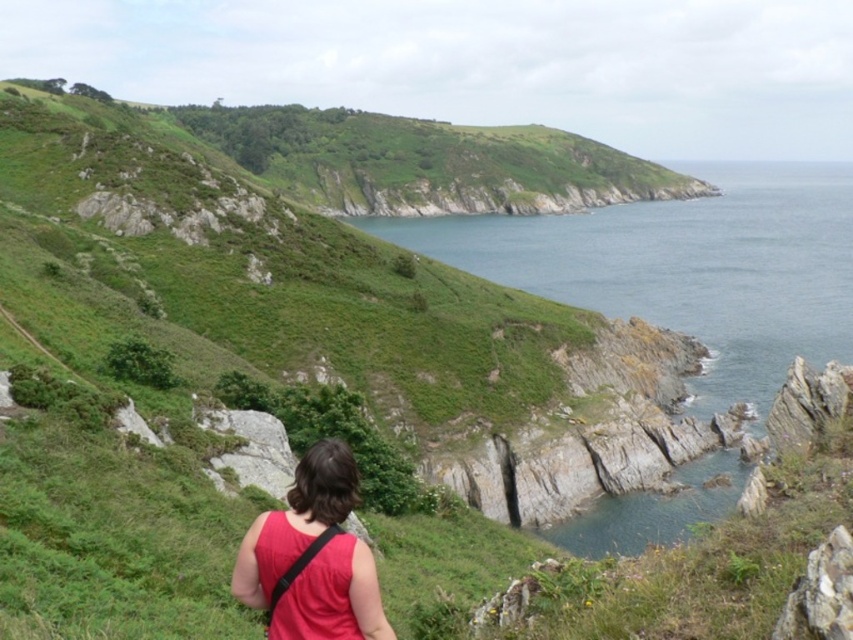
Is blue water at upper right above red matte tank top at lower center?

Yes.

Who is lower down, blue water at upper right or red matte tank top at lower center?

red matte tank top at lower center is below.

You are a GUI agent. You are given a task and a screenshot of the screen. Output one action in this format:
    pyautogui.click(x=<x>, y=<y>)
    Task: Click on the blue water at upper right
    The width and height of the screenshot is (853, 640).
    Given the screenshot: What is the action you would take?
    pyautogui.click(x=688, y=268)

Locate an element on the screen. blue water at upper right is located at coordinates (688, 268).